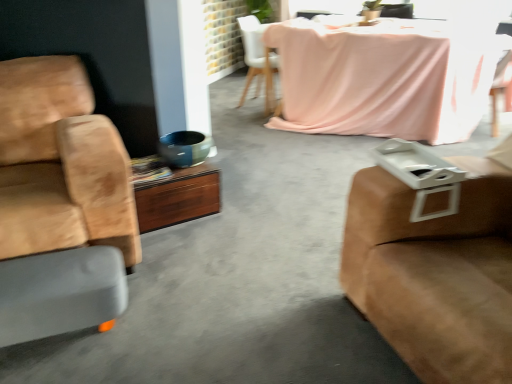
Question: Should I look upward or downward to see matte green ceramic bowl at center?

Choices:
 (A) down
 (B) up

Answer: (B)

Question: Are wooden desk at center and suede brown studio couch at right far apart?

Choices:
 (A) yes
 (B) no

Answer: (A)

Question: Does wooden desk at center appear on the left side of suede brown studio couch at right?

Choices:
 (A) no
 (B) yes

Answer: (B)

Question: Can you confirm if wooden desk at center is wider than suede brown studio couch at right?

Choices:
 (A) no
 (B) yes

Answer: (A)

Question: Considering the relative sizes of wooden desk at center and suede brown studio couch at right in the image provided, is wooden desk at center thinner than suede brown studio couch at right?

Choices:
 (A) yes
 (B) no

Answer: (A)

Question: Is wooden desk at center positioned behind suede brown studio couch at right?

Choices:
 (A) no
 (B) yes

Answer: (B)

Question: Can you confirm if wooden desk at center is shorter than suede brown studio couch at right?

Choices:
 (A) yes
 (B) no

Answer: (A)

Question: From the image's perspective, does pink fabric-covered table at upper center appear lower than matte green ceramic bowl at center?

Choices:
 (A) no
 (B) yes

Answer: (A)

Question: Considering the relative sizes of pink fabric-covered table at upper center and matte green ceramic bowl at center in the image provided, is pink fabric-covered table at upper center smaller than matte green ceramic bowl at center?

Choices:
 (A) yes
 (B) no

Answer: (B)

Question: Is pink fabric-covered table at upper center completely or partially outside of matte green ceramic bowl at center?

Choices:
 (A) no
 (B) yes

Answer: (B)

Question: Is pink fabric-covered table at upper center wider than matte green ceramic bowl at center?

Choices:
 (A) yes
 (B) no

Answer: (A)

Question: Is pink fabric-covered table at upper center oriented towards matte green ceramic bowl at center?

Choices:
 (A) no
 (B) yes

Answer: (B)

Question: Considering the relative sizes of pink fabric-covered table at upper center and matte green ceramic bowl at center in the image provided, is pink fabric-covered table at upper center thinner than matte green ceramic bowl at center?

Choices:
 (A) no
 (B) yes

Answer: (A)

Question: Is gray rubber footrest at lower left far away from pink fabric chair at upper center, the third chair in the front-to-back sequence?

Choices:
 (A) yes
 (B) no

Answer: (A)